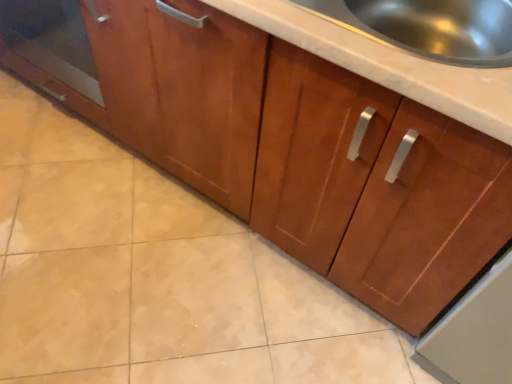
Question: Considering the positions of transparent glass door at left and stainless steel sink at upper right in the image, is transparent glass door at left taller or shorter than stainless steel sink at upper right?

Choices:
 (A) short
 (B) tall

Answer: (B)

Question: From the image's perspective, is transparent glass door at left positioned above or below stainless steel sink at upper right?

Choices:
 (A) below
 (B) above

Answer: (B)

Question: Would you say transparent glass door at left is to the left or to the right of stainless steel sink at upper right in the picture?

Choices:
 (A) left
 (B) right

Answer: (A)

Question: In terms of height, does stainless steel sink at upper right look taller or shorter compared to transparent glass door at left?

Choices:
 (A) short
 (B) tall

Answer: (A)

Question: From a real-world perspective, is stainless steel sink at upper right above or below transparent glass door at left?

Choices:
 (A) above
 (B) below

Answer: (A)

Question: Considering the positions of stainless steel sink at upper right and transparent glass door at left in the image, is stainless steel sink at upper right wider or thinner than transparent glass door at left?

Choices:
 (A) wide
 (B) thin

Answer: (B)

Question: Choose the correct answer: Is stainless steel sink at upper right inside transparent glass door at left or outside it?

Choices:
 (A) outside
 (B) inside

Answer: (A)